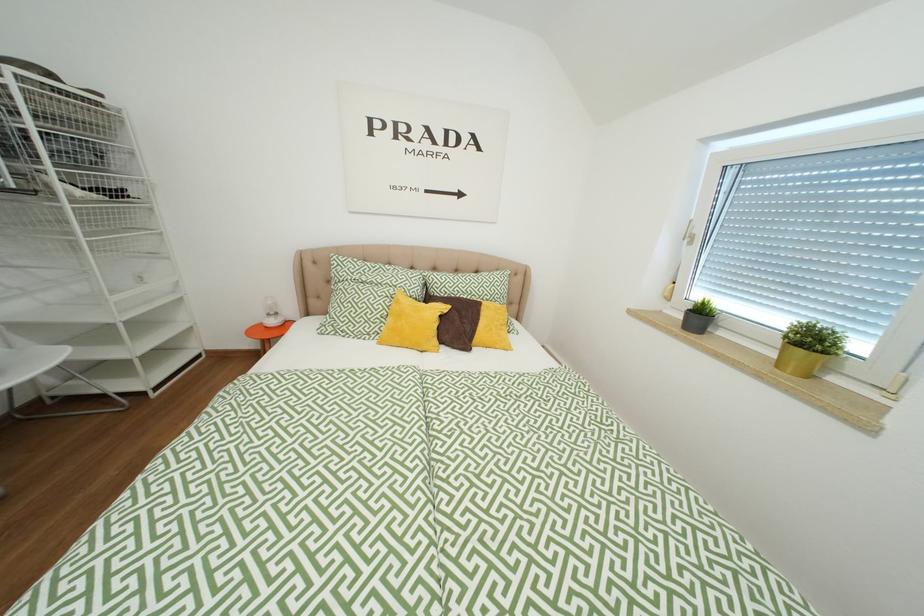
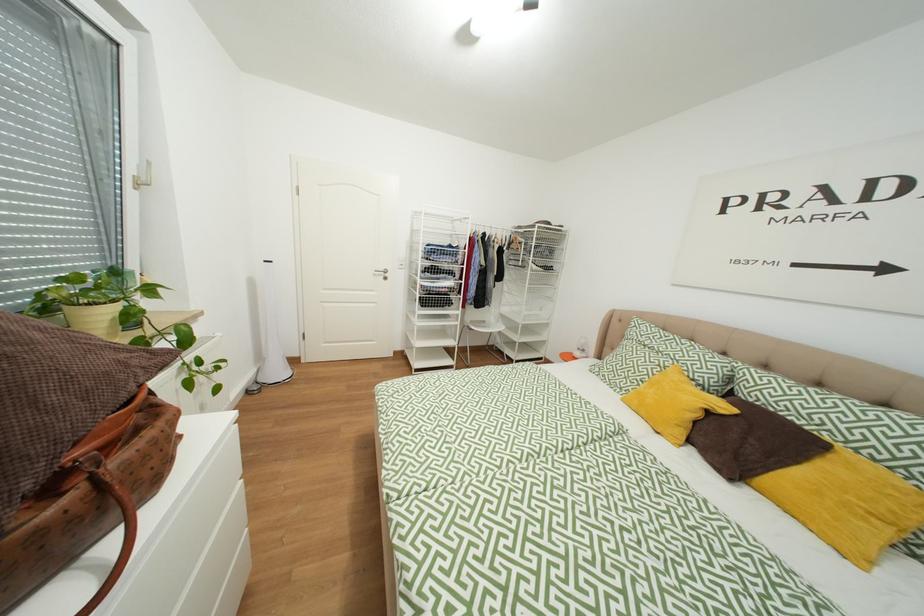
Question: The camera is either moving clockwise (left) or counter-clockwise (right) around the object. The first image is from the beginning of the video and the second image is from the end. Is the camera moving left or right when shooting the video?

Choices:
 (A) Left
 (B) Right

Answer: (B)